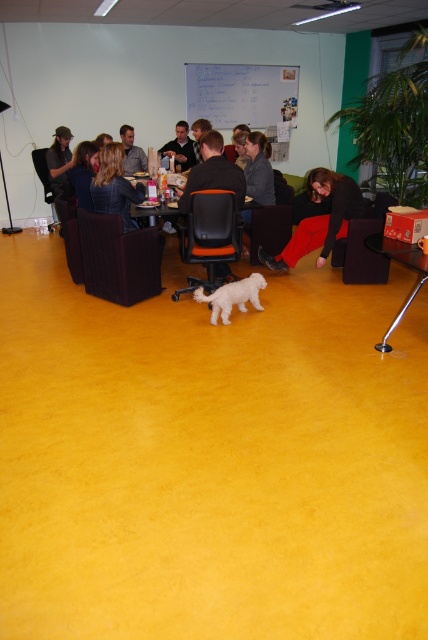
What do you see at coordinates (273, 220) in the screenshot?
I see `orange fabric chair at center` at bounding box center [273, 220].

In order to click on orange fabric chair at center in this screenshot , I will do `click(273, 220)`.

Can you confirm if matte black jacket at upper left is taller than matte gray shirt at center?

Indeed, matte black jacket at upper left has a greater height compared to matte gray shirt at center.

From the picture: Does matte black jacket at upper left lie behind matte gray shirt at center?

No, matte black jacket at upper left is closer to the viewer.

Is point (71, 176) farther from camera compared to point (134, 160)?

That is False.

I want to click on matte black jacket at upper left, so click(83, 172).

Looking at this image, does velvet-like dark brown chair at center have a smaller size compared to orange fabric chair at center?

No.

Is velvet-like dark brown chair at center positioned at the back of orange fabric chair at center?

No, velvet-like dark brown chair at center is in front of orange fabric chair at center.

Is point (136, 288) positioned in front of point (252, 230)?

Yes.

Where is `velvet-like dark brown chair at center`? The image size is (428, 640). velvet-like dark brown chair at center is located at coordinates (118, 259).